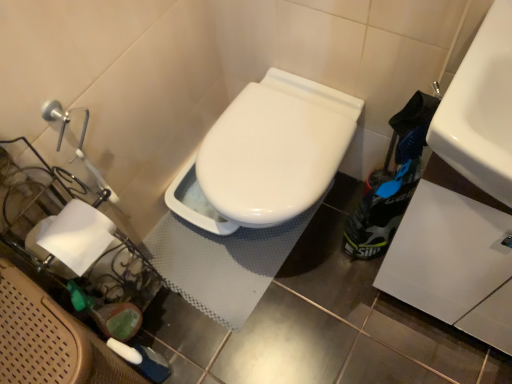
Question: Is white paper at left to the left or to the right of white glossy sink at upper right in the image?

Choices:
 (A) right
 (B) left

Answer: (B)

Question: Relative to white glossy sink at upper right, is white paper at left in front or behind?

Choices:
 (A) front
 (B) behind

Answer: (B)

Question: Which is farther from the white textured bath mat at center?

Choices:
 (A) white paper at left
 (B) white glossy sink at upper right

Answer: (B)

Question: Which is farther from the white glossy sink at upper right?

Choices:
 (A) white paper at left
 (B) white textured bath mat at center

Answer: (B)